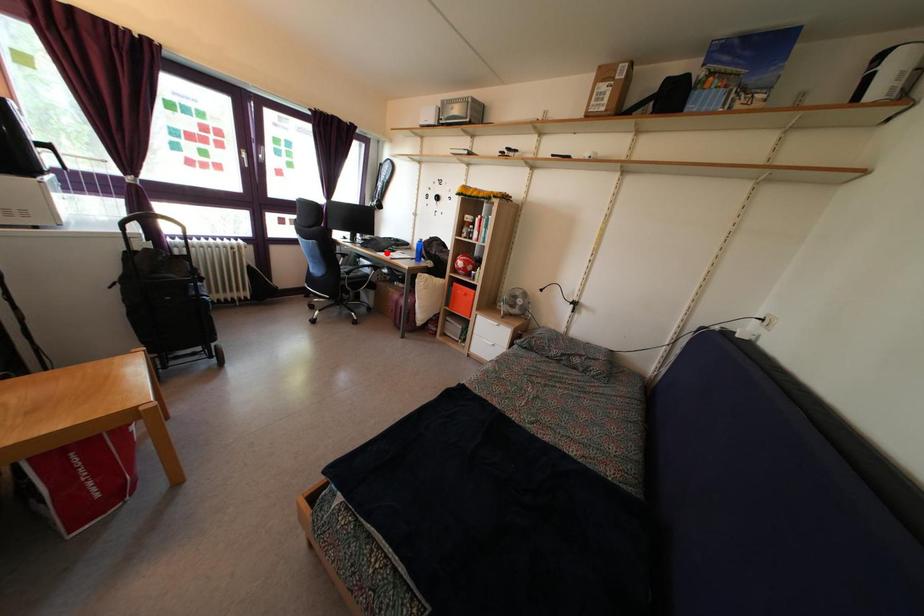
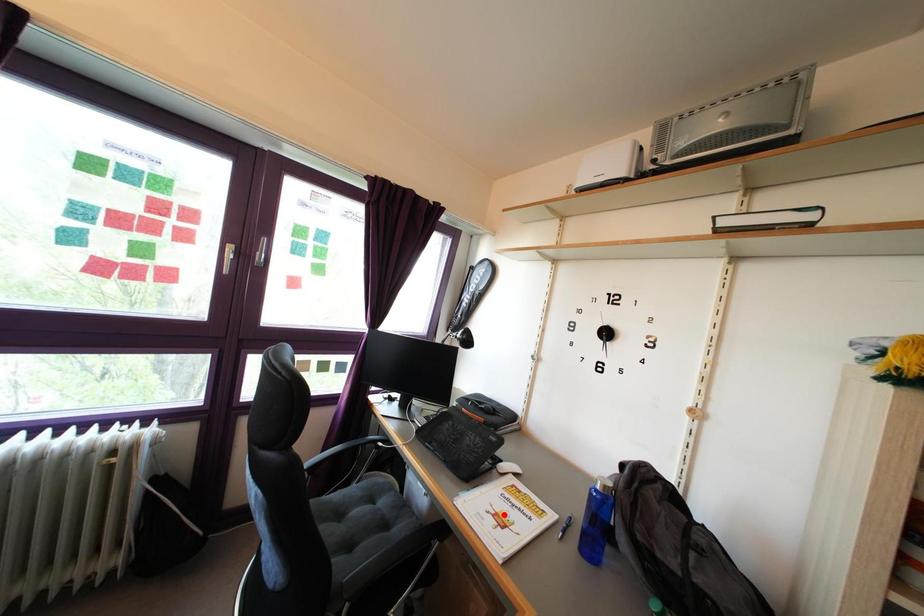
I am providing you with two images of the same scene from different viewpoints. A red point is marked on the first image and another point is marked on the second image. Is the marked point in image1 the same physical position as the marked point in image2?

No